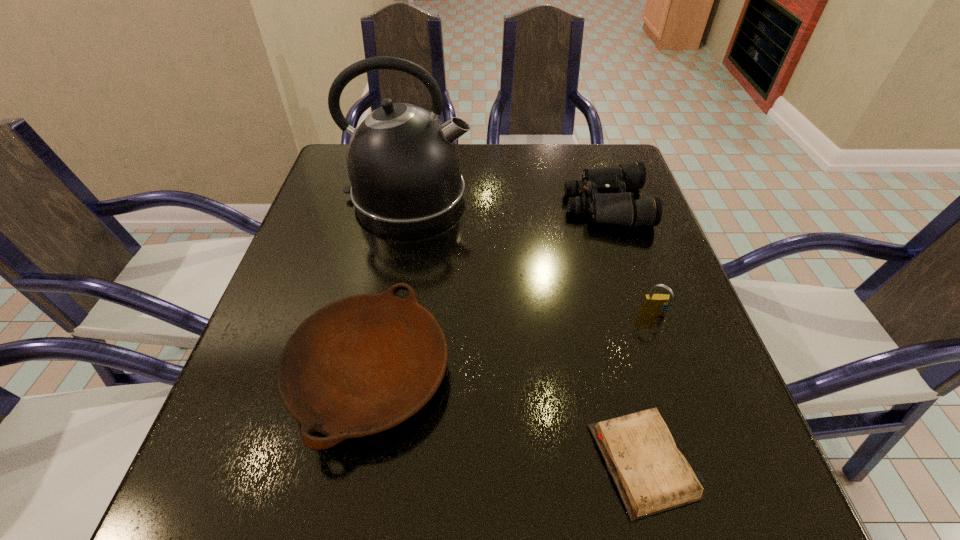
At what (x,y) coordinates should I click in order to perform the action: click on the tallest object. Please return your answer as a coordinate pair (x, y). The height and width of the screenshot is (540, 960). Looking at the image, I should click on (402, 161).

This screenshot has width=960, height=540. What are the coordinates of `padlock` in the screenshot? It's located at (653, 304).

I want to click on plate, so click(x=360, y=365).

Identify the location of binoculars. [x=608, y=202].

Where is `the shortest object`? This screenshot has width=960, height=540. the shortest object is located at coordinates (652, 476).

Where is `vacant space located on the spout of the tallest object`? vacant space located on the spout of the tallest object is located at coordinates (610, 197).

At what (x,y) coordinates should I click in order to perform the action: click on blank space located on the side with the combination dials of the second tallest object. Please return your answer as a coordinate pair (x, y). This screenshot has height=540, width=960. Looking at the image, I should click on click(697, 436).

At what (x,y) coordinates should I click in order to perform the action: click on free space located 0.050m on the back of the plate. Please return your answer as a coordinate pair (x, y). Looking at the image, I should click on (388, 286).

I want to click on vacant space situated 0.340m through the eyepieces of the binoculars, so click(424, 205).

Identify the location of free space located through the eyepieces of the binoculars. (466, 205).